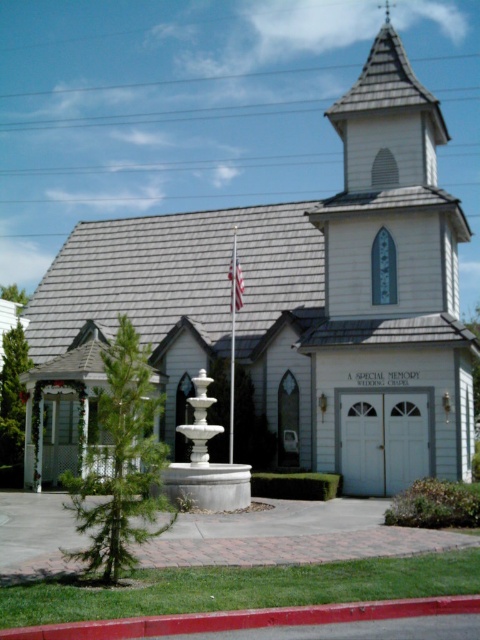
What do you see at coordinates (232, 336) in the screenshot? I see `white glossy flag pole at center` at bounding box center [232, 336].

Between point (232, 273) and point (236, 269), which one is positioned behind?

Point (236, 269)

The width and height of the screenshot is (480, 640). What do you see at coordinates (232, 336) in the screenshot?
I see `white glossy flag pole at center` at bounding box center [232, 336].

Locate an element on the screen. The image size is (480, 640). white glossy flag pole at center is located at coordinates (232, 336).